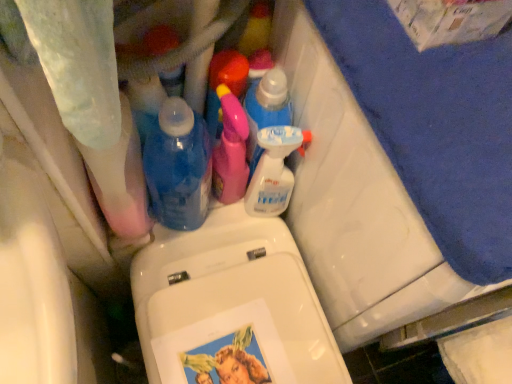
Question: Could you tell me if blue fabric bath towel at upper right is facing pink plastic spray bottle at center, which appears as the third cleaning product when viewed from the right?

Choices:
 (A) no
 (B) yes

Answer: (A)

Question: Can you confirm if blue fabric bath towel at upper right is positioned to the left of pink plastic spray bottle at center, which appears as the third cleaning product when viewed from the right?

Choices:
 (A) yes
 (B) no

Answer: (B)

Question: From the image's perspective, is blue fabric bath towel at upper right below pink plastic spray bottle at center, which appears as the third cleaning product when viewed from the right?

Choices:
 (A) no
 (B) yes

Answer: (B)

Question: Can you confirm if blue fabric bath towel at upper right is bigger than pink plastic spray bottle at center, which appears as the third cleaning product when viewed from the right?

Choices:
 (A) no
 (B) yes

Answer: (B)

Question: From a real-world perspective, is blue fabric bath towel at upper right physically above pink plastic spray bottle at center, which appears as the third cleaning product when viewed from the right?

Choices:
 (A) no
 (B) yes

Answer: (A)

Question: Would you say pink plastic spray bottle at center, which appears as the third cleaning product when viewed from the right, is to the left or to the right of clear plastic spray bottle at upper center, which ranks as the first cleaning product in right-to-left order, in the picture?

Choices:
 (A) right
 (B) left

Answer: (B)

Question: Considering the positions of pink plastic spray bottle at center, which appears as the third cleaning product when viewed from the right, and clear plastic spray bottle at upper center, arranged as the 4th cleaning product when viewed from the left, in the image, is pink plastic spray bottle at center, which appears as the third cleaning product when viewed from the right, bigger or smaller than clear plastic spray bottle at upper center, arranged as the 4th cleaning product when viewed from the left,?

Choices:
 (A) small
 (B) big

Answer: (B)

Question: From the image's perspective, is pink plastic spray bottle at center, arranged as the 2th cleaning product when viewed from the left, above or below clear plastic spray bottle at upper center, arranged as the 4th cleaning product when viewed from the left?

Choices:
 (A) above
 (B) below

Answer: (A)

Question: Considering the positions of point (218, 145) and point (283, 152), is point (218, 145) closer or farther from the camera than point (283, 152)?

Choices:
 (A) closer
 (B) farther

Answer: (B)

Question: Based on their sizes in the image, would you say translucent plastic spray bottle at center, marked as the 2th cleaning product in a right-to-left arrangement, is bigger or smaller than blue fabric bath towel at upper right?

Choices:
 (A) small
 (B) big

Answer: (A)

Question: Visually, is translucent plastic spray bottle at center, placed as the third cleaning product when sorted from left to right, positioned to the left or to the right of blue fabric bath towel at upper right?

Choices:
 (A) right
 (B) left

Answer: (B)

Question: Looking at their shapes, would you say translucent plastic spray bottle at center, placed as the third cleaning product when sorted from left to right, is wider or thinner than blue fabric bath towel at upper right?

Choices:
 (A) wide
 (B) thin

Answer: (B)

Question: In the image, is translucent plastic spray bottle at center, marked as the 2th cleaning product in a right-to-left arrangement, positioned in front of or behind blue fabric bath towel at upper right?

Choices:
 (A) behind
 (B) front

Answer: (A)

Question: Considering the positions of pink plastic spray bottle at center, positioned as the first cleaning product in left-to-right order, and blue fabric bath towel at upper right in the image, is pink plastic spray bottle at center, positioned as the first cleaning product in left-to-right order, bigger or smaller than blue fabric bath towel at upper right?

Choices:
 (A) small
 (B) big

Answer: (A)

Question: Relative to blue fabric bath towel at upper right, is pink plastic spray bottle at center, which ranks as the 4th cleaning product in right-to-left order, in front or behind?

Choices:
 (A) front
 (B) behind

Answer: (B)